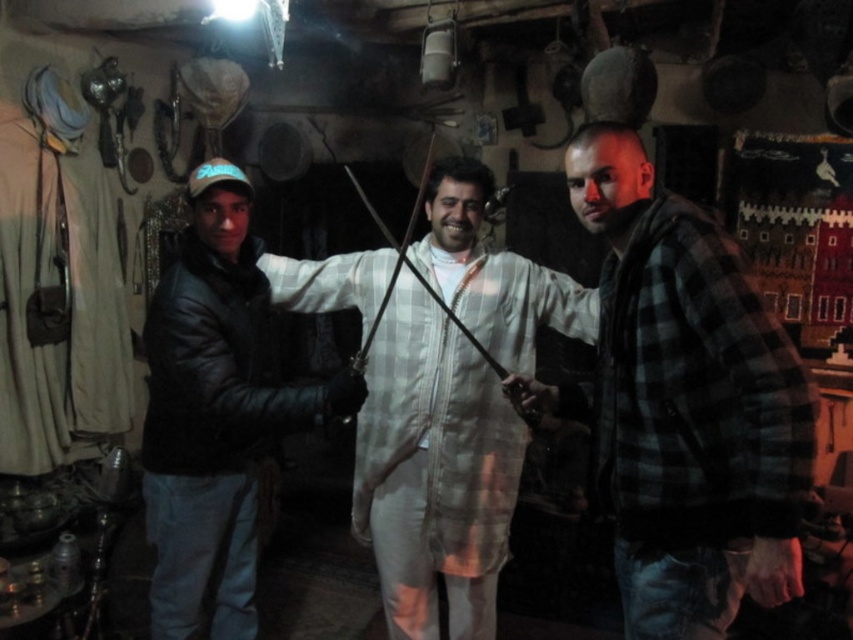
Question: Can you confirm if white matte sword at center is positioned to the left of black leather jacket at left?

Choices:
 (A) no
 (B) yes

Answer: (A)

Question: Which point is farther to the camera?

Choices:
 (A) white matte sword at center
 (B) black leather jacket at left
 (C) white checkered robe at center
 (D) plaid flannel shirt at right

Answer: (A)

Question: Does plaid flannel shirt at right appear under white checkered robe at center?

Choices:
 (A) no
 (B) yes

Answer: (A)

Question: Does plaid flannel shirt at right appear on the left side of white checkered robe at center?

Choices:
 (A) no
 (B) yes

Answer: (A)

Question: Which point appears closest to the camera in this image?

Choices:
 (A) [x=253, y=368]
 (B) [x=666, y=228]
 (C) [x=398, y=481]

Answer: (B)

Question: Which object is closer to the camera taking this photo?

Choices:
 (A) white matte sword at center
 (B) black leather jacket at left
 (C) plaid flannel shirt at right
 (D) white checkered robe at center

Answer: (C)